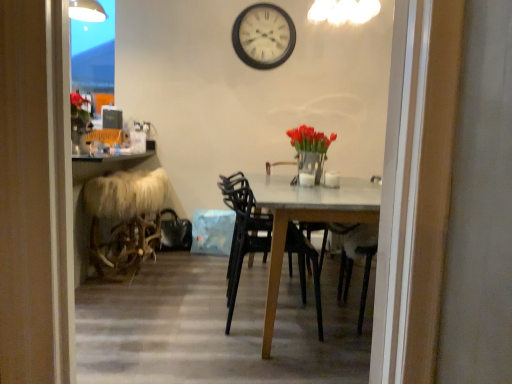
Question: Is the depth of transparent glass door at upper left greater than that of matte silver vase with red tulips at center?

Choices:
 (A) yes
 (B) no

Answer: (A)

Question: Is transparent glass door at upper left wider than matte silver vase with red tulips at center?

Choices:
 (A) yes
 (B) no

Answer: (B)

Question: Is transparent glass door at upper left in contact with matte silver vase with red tulips at center?

Choices:
 (A) no
 (B) yes

Answer: (A)

Question: Is transparent glass door at upper left shorter than matte silver vase with red tulips at center?

Choices:
 (A) yes
 (B) no

Answer: (B)

Question: From the image's perspective, is transparent glass door at upper left below matte silver vase with red tulips at center?

Choices:
 (A) no
 (B) yes

Answer: (A)

Question: Based on their positions, is matte silver vase with red tulips at center located to the left or right of transparent glass door at upper left?

Choices:
 (A) left
 (B) right

Answer: (B)

Question: Is point (297, 160) closer or farther from the camera than point (113, 91)?

Choices:
 (A) farther
 (B) closer

Answer: (B)

Question: From the image's perspective, is matte silver vase with red tulips at center positioned above or below transparent glass door at upper left?

Choices:
 (A) below
 (B) above

Answer: (A)

Question: In terms of size, does matte silver vase with red tulips at center appear bigger or smaller than transparent glass door at upper left?

Choices:
 (A) big
 (B) small

Answer: (B)

Question: Choose the correct answer: Is matte silver vase with red tulips at center inside black plastic chair at center or outside it?

Choices:
 (A) outside
 (B) inside

Answer: (A)

Question: Looking at the image, does matte silver vase with red tulips at center seem bigger or smaller compared to black plastic chair at center?

Choices:
 (A) big
 (B) small

Answer: (B)

Question: Is matte silver vase with red tulips at center taller or shorter than black plastic chair at center?

Choices:
 (A) tall
 (B) short

Answer: (B)

Question: From a real-world perspective, is matte silver vase with red tulips at center physically located above or below black plastic chair at center?

Choices:
 (A) above
 (B) below

Answer: (A)

Question: From the image's perspective, is white matte wall clock at upper center above or below transparent glass door at upper left?

Choices:
 (A) below
 (B) above

Answer: (B)

Question: Is white matte wall clock at upper center bigger or smaller than transparent glass door at upper left?

Choices:
 (A) small
 (B) big

Answer: (A)